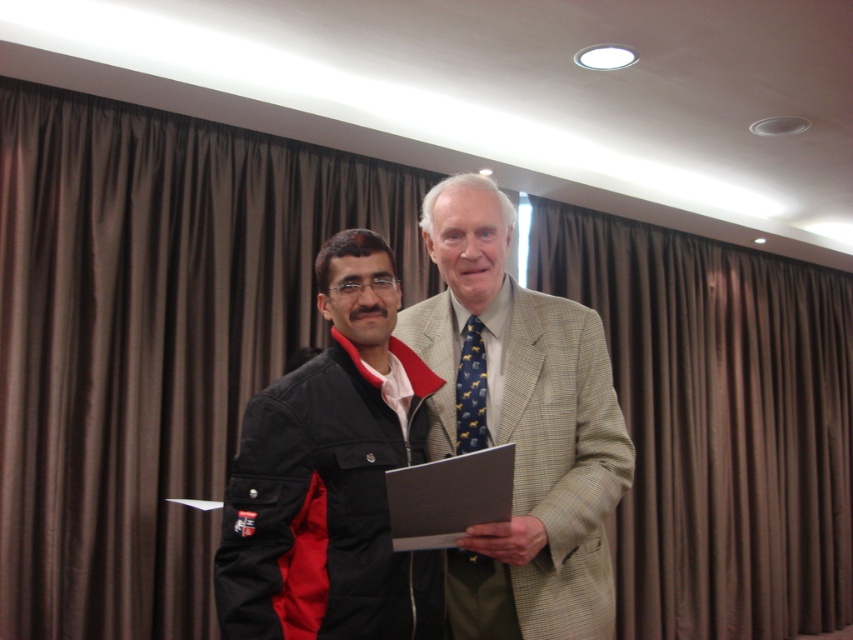
Between point (577, 388) and point (486, 388), which one is positioned in front?

Positioned in front is point (486, 388).

Does light beige textured suit at center have a lesser width compared to blue patterned tie at center?

Incorrect, light beige textured suit at center's width is not less than blue patterned tie at center's.

Where is `light beige textured suit at center`? This screenshot has height=640, width=853. light beige textured suit at center is located at coordinates (521, 428).

Where is `light beige textured suit at center`? light beige textured suit at center is located at coordinates (521, 428).

Describe the element at coordinates (521, 428) in the screenshot. The width and height of the screenshot is (853, 640). I see `light beige textured suit at center` at that location.

Which is in front, point (473, 248) or point (282, 604)?

Point (282, 604) is more forward.

Does point (479, 538) come behind point (316, 604)?

Yes, it is.

You are a GUI agent. You are given a task and a screenshot of the screen. Output one action in this format:
    pyautogui.click(x=<x>, y=<y>)
    Task: Click on the light beige textured suit at center
    
    Given the screenshot: What is the action you would take?
    pyautogui.click(x=521, y=428)

Who is higher up, black fabric jacket at center or blue patterned tie at center?

blue patterned tie at center is higher up.

Which of these two, black fabric jacket at center or blue patterned tie at center, stands taller?

black fabric jacket at center is taller.

Image resolution: width=853 pixels, height=640 pixels. What do you see at coordinates (329, 476) in the screenshot? I see `black fabric jacket at center` at bounding box center [329, 476].

Locate an element on the screen. The height and width of the screenshot is (640, 853). black fabric jacket at center is located at coordinates (329, 476).